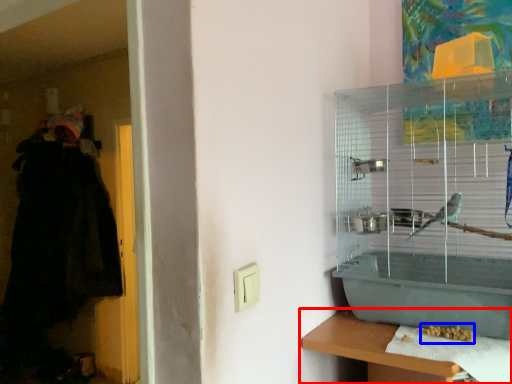
Question: Which object appears farthest to the camera in this image, shelf (highlighted by a red box) or food (highlighted by a blue box)?

Choices:
 (A) shelf
 (B) food

Answer: (B)